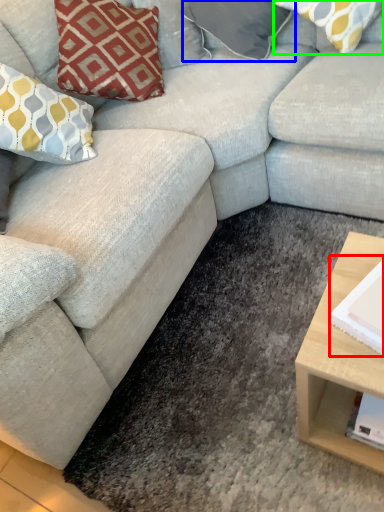
Question: Which object is positioned closest to magazine (highlighted by a red box)? Select from pillow (highlighted by a blue box) and pillow (highlighted by a green box).

Choices:
 (A) pillow
 (B) pillow

Answer: (B)